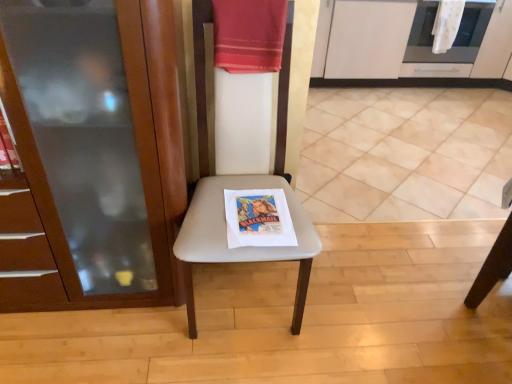
Measure the distance between beige fabric chair at center and camera.

The depth of beige fabric chair at center is 4.08 feet.

Describe the element at coordinates (224, 214) in the screenshot. I see `beige fabric chair at center` at that location.

You are a GUI agent. You are given a task and a screenshot of the screen. Output one action in this format:
    pyautogui.click(x=<x>, y=<y>)
    Task: Click on the white textured towel at upper right, the 1th beach towel in the right-to-left sequence
    The image size is (512, 384).
    Given the screenshot: What is the action you would take?
    pyautogui.click(x=446, y=24)

What do you see at coordinates (249, 35) in the screenshot? I see `red cotton towel at upper center, acting as the first beach towel starting from the bottom` at bounding box center [249, 35].

Measure the distance between white matte cabinet at upper right, which ranks as the 1th cabinetry in back-to-front order, and camera.

white matte cabinet at upper right, which ranks as the 1th cabinetry in back-to-front order, is 9.83 feet from camera.

Describe the element at coordinates (368, 38) in the screenshot. I see `white matte cabinet at upper right, the 1th cabinetry positioned from the top` at that location.

Locate an element on the screen. This screenshot has height=384, width=512. matte wood cabinet at left, positioned as the 2th cabinetry in back-to-front order is located at coordinates (91, 155).

Identify the location of stainless steel oven at upper right. (452, 43).

Is white matte cabinet at upper right, which ranks as the 1th cabinetry in back-to-front order, aimed at red cotton towel at upper center, acting as the 2th beach towel starting from the right?

No.

Is white matte cabinet at upper right, the 1th cabinetry positioned from the top, with red cotton towel at upper center, the second beach towel viewed from the back?

No, white matte cabinet at upper right, the 1th cabinetry positioned from the top, is not making contact with red cotton towel at upper center, the second beach towel viewed from the back.

Is white matte cabinet at upper right, which ranks as the 1th cabinetry in back-to-front order, outside of red cotton towel at upper center, which is the 1th beach towel in left-to-right order?

That's correct, white matte cabinet at upper right, which ranks as the 1th cabinetry in back-to-front order, is outside of red cotton towel at upper center, which is the 1th beach towel in left-to-right order.

Based on the photo, from a real-world perspective, between white matte cabinet at upper right, marked as the 2th cabinetry in a left-to-right arrangement, and red cotton towel at upper center, which is the 1th beach towel in left-to-right order, who is vertically higher?

In real-world perspective, red cotton towel at upper center, which is the 1th beach towel in left-to-right order, is above.

Does white textured towel at upper right, placed as the first beach towel when sorted from back to front, have a lesser height compared to beige fabric chair at center?

Correct, white textured towel at upper right, placed as the first beach towel when sorted from back to front, is not as tall as beige fabric chair at center.

Considering the points (458, 20) and (203, 202), which point is in front, point (458, 20) or point (203, 202)?

The point (203, 202) is in front.

Considering the sizes of white textured towel at upper right, the second beach towel in the left-to-right sequence, and beige fabric chair at center in the image, is white textured towel at upper right, the second beach towel in the left-to-right sequence, wider or thinner than beige fabric chair at center?

white textured towel at upper right, the second beach towel in the left-to-right sequence, is thinner than beige fabric chair at center.

Can you tell me how much white textured towel at upper right, the second beach towel from the front, and beige fabric chair at center differ in facing direction?

There is a 0.692-degree angle between the facing directions of white textured towel at upper right, the second beach towel from the front, and beige fabric chair at center.

Is red cotton towel at upper center, the 2th beach towel when ordered from top to bottom, inside the boundaries of stainless steel oven at upper right, or outside?

red cotton towel at upper center, the 2th beach towel when ordered from top to bottom, is located beyond the bounds of stainless steel oven at upper right.

Considering the relative sizes of red cotton towel at upper center, acting as the 2th beach towel starting from the right, and stainless steel oven at upper right in the image provided, is red cotton towel at upper center, acting as the 2th beach towel starting from the right, smaller than stainless steel oven at upper right?

Yes.

How distant is red cotton towel at upper center, the second beach towel viewed from the back, from stainless steel oven at upper right?

red cotton towel at upper center, the second beach towel viewed from the back, is 2.36 meters from stainless steel oven at upper right.

Consider the image. From a real-world perspective, which object rests below the other?

stainless steel oven at upper right is physically lower.

Does stainless steel oven at upper right have a greater height compared to matte wood cabinet at left, arranged as the second cabinetry when viewed from the top?

Incorrect, the height of stainless steel oven at upper right is not larger of that of matte wood cabinet at left, arranged as the second cabinetry when viewed from the top.

The width and height of the screenshot is (512, 384). Identify the location of the 2nd cabinetry counting from the left side of the stainless steel oven at upper right. (91, 155).

Is stainless steel oven at upper right positioned beyond the bounds of matte wood cabinet at left, the second cabinetry in the right-to-left sequence?

stainless steel oven at upper right is positioned outside matte wood cabinet at left, the second cabinetry in the right-to-left sequence.

Can you tell me how much stainless steel oven at upper right and matte wood cabinet at left, positioned as the 2th cabinetry in back-to-front order, differ in facing direction?

The angular difference between stainless steel oven at upper right and matte wood cabinet at left, positioned as the 2th cabinetry in back-to-front order, is 2.56e-06 degrees.

Find the location of a particular element. The width and height of the screenshot is (512, 384). beach towel that is the 2nd one when counting downward from the stainless steel oven at upper right (from the image's perspective) is located at coordinates (249, 35).

How different are the orientations of stainless steel oven at upper right and red cotton towel at upper center, acting as the first beach towel starting from the bottom, in degrees?

0.647 degrees.

Is stainless steel oven at upper right shorter than red cotton towel at upper center, the second beach towel viewed from the back?

No.

From the image's perspective, which is below, stainless steel oven at upper right or red cotton towel at upper center, the second beach towel viewed from the back?

red cotton towel at upper center, the second beach towel viewed from the back, is shown below in the image.

Looking at their sizes, would you say red cotton towel at upper center, acting as the first beach towel starting from the bottom, is wider or thinner than white textured towel at upper right, the 1th beach towel in the right-to-left sequence?

In the image, red cotton towel at upper center, acting as the first beach towel starting from the bottom, appears to be wider than white textured towel at upper right, the 1th beach towel in the right-to-left sequence.

Is red cotton towel at upper center, acting as the 2th beach towel starting from the right, to the right of white textured towel at upper right, positioned as the second beach towel in bottom-to-top order, from the viewer's perspective?

No.

Can you confirm if red cotton towel at upper center, the second beach towel viewed from the back, is smaller than white textured towel at upper right, the first beach towel from the top?

Incorrect, red cotton towel at upper center, the second beach towel viewed from the back, is not smaller in size than white textured towel at upper right, the first beach towel from the top.

Is the position of red cotton towel at upper center, the 2th beach towel when ordered from top to bottom, less distant than that of white textured towel at upper right, the second beach towel from the front?

Yes.

Does white matte cabinet at upper right, marked as the second cabinetry in a front-to-back arrangement, turn towards matte wood cabinet at left, which is counted as the first cabinetry, starting from the left?

No, white matte cabinet at upper right, marked as the second cabinetry in a front-to-back arrangement, is not oriented towards matte wood cabinet at left, which is counted as the first cabinetry, starting from the left.

In terms of width, does white matte cabinet at upper right, marked as the 2th cabinetry in a left-to-right arrangement, look wider or thinner when compared to matte wood cabinet at left, which is the 1th cabinetry from front to back?

white matte cabinet at upper right, marked as the 2th cabinetry in a left-to-right arrangement, is wider than matte wood cabinet at left, which is the 1th cabinetry from front to back.

From the image's perspective, which is above, white matte cabinet at upper right, marked as the 2th cabinetry in a left-to-right arrangement, or matte wood cabinet at left, the second cabinetry in the right-to-left sequence?

white matte cabinet at upper right, marked as the 2th cabinetry in a left-to-right arrangement, is shown above in the image.

Which is farther, (386, 72) or (30, 40)?

The point (386, 72) is behind.

From a real-world perspective, count 2nd cabinetrys downward from the red cotton towel at upper center, marked as the first beach towel in a front-to-back arrangement, and point to it. Please provide its 2D coordinates.

[(368, 38)]

Locate an element on the screen. chair that is above the white textured towel at upper right, the second beach towel in the left-to-right sequence (from a real-world perspective) is located at coordinates (224, 214).

Considering their positions, is stainless steel oven at upper right positioned closer to white textured towel at upper right, the second beach towel from the front, than white matte cabinet at upper right, marked as the 2th cabinetry in a left-to-right arrangement?

The object closer to white textured towel at upper right, the second beach towel from the front, is stainless steel oven at upper right.

Looking at the image, which one is located closer to beige fabric chair at center, white matte cabinet at upper right, the 1th cabinetry positioned from the top, or matte wood cabinet at left, acting as the 1th cabinetry starting from the bottom?

Among the two, matte wood cabinet at left, acting as the 1th cabinetry starting from the bottom, is located nearer to beige fabric chair at center.

From the image, which object appears to be farther from red cotton towel at upper center, the 2th beach towel when ordered from top to bottom, matte wood cabinet at left, arranged as the second cabinetry when viewed from the top, or white textured towel at upper right, the second beach towel from the front?

white textured towel at upper right, the second beach towel from the front, is positioned further to the anchor red cotton towel at upper center, the 2th beach towel when ordered from top to bottom.

Considering their positions, is white matte cabinet at upper right, marked as the second cabinetry in a front-to-back arrangement, positioned closer to red cotton towel at upper center, acting as the 2th beach towel starting from the right, than matte wood cabinet at left, positioned as the 2th cabinetry in back-to-front order?

Based on the image, matte wood cabinet at left, positioned as the 2th cabinetry in back-to-front order, appears to be nearer to red cotton towel at upper center, acting as the 2th beach towel starting from the right.

From the image, which object appears to be nearer to stainless steel oven at upper right, red cotton towel at upper center, the second beach towel viewed from the back, or matte wood cabinet at left, the second cabinetry in the right-to-left sequence?

red cotton towel at upper center, the second beach towel viewed from the back, is closer to stainless steel oven at upper right.

Estimate the real-world distances between objects in this image. Which object is further from white textured towel at upper right, placed as the first beach towel when sorted from back to front, beige fabric chair at center or stainless steel oven at upper right?

beige fabric chair at center is further to white textured towel at upper right, placed as the first beach towel when sorted from back to front.

From the image, which object appears to be nearer to stainless steel oven at upper right, white textured towel at upper right, the first beach towel from the top, or red cotton towel at upper center, the 2th beach towel when ordered from top to bottom?

Based on the image, white textured towel at upper right, the first beach towel from the top, appears to be nearer to stainless steel oven at upper right.

Which object lies nearer to the anchor point red cotton towel at upper center, marked as the first beach towel in a front-to-back arrangement, matte wood cabinet at left, which is the 1th cabinetry from front to back, or stainless steel oven at upper right?

matte wood cabinet at left, which is the 1th cabinetry from front to back.

What are the coordinates of `beach towel positioned between matte wood cabinet at left, acting as the 1th cabinetry starting from the bottom, and white matte cabinet at upper right, the 1th cabinetry positioned from the top, from near to far` in the screenshot? It's located at (249, 35).

Identify the location of beach towel between beige fabric chair at center and white textured towel at upper right, the second beach towel in the left-to-right sequence, along the z-axis. (249, 35).

The image size is (512, 384). Identify the location of cabinetry between red cotton towel at upper center, which is the 1th beach towel in left-to-right order, and stainless steel oven at upper right in the front-back direction. (368, 38).

At what (x,y) coordinates should I click in order to perform the action: click on beach towel between red cotton towel at upper center, which is the 1th beach towel in left-to-right order, and stainless steel oven at upper right in the front-back direction. Please return your answer as a coordinate pair (x, y). Looking at the image, I should click on (446, 24).